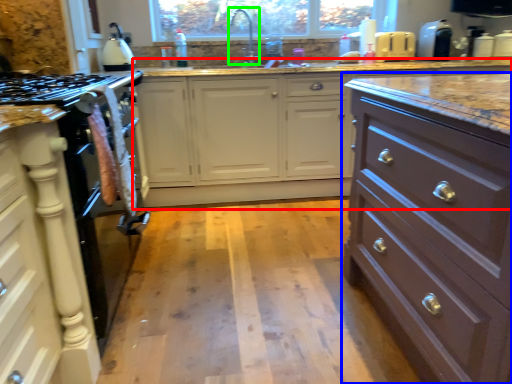
Question: Which object is positioned closest to counter (highlighted by a red box)? Select from chest of drawers (highlighted by a blue box) and faucet (highlighted by a green box).

Choices:
 (A) chest of drawers
 (B) faucet

Answer: (B)